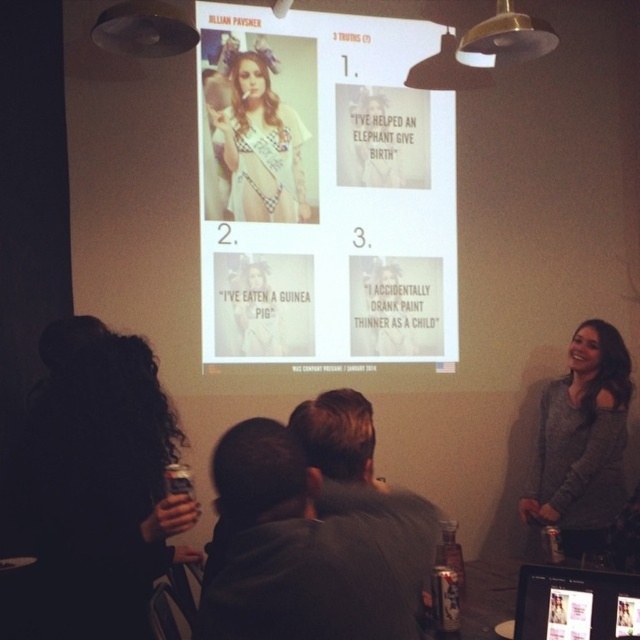
Question: Which of these objects is positioned closest to the dark curly hair at lower left?

Choices:
 (A) white paper at center
 (B) dark gray hoodie at center
 (C) matte plastic screen at lower right

Answer: (B)

Question: Does dark gray hoodie at center appear on the left side of matte plastic screen at lower right?

Choices:
 (A) yes
 (B) no

Answer: (A)

Question: Which point is farther from the camera taking this photo?

Choices:
 (A) (536, 632)
 (B) (292, 116)
 (C) (45, 429)

Answer: (B)

Question: Considering the real-world distances, which object is farthest from the checkered fabric bikini at center?

Choices:
 (A) matte plastic screen at lower right
 (B) gray sweater at center
 (C) white paper at center

Answer: (A)

Question: Is white paper at center bigger than dark curly hair at lower left?

Choices:
 (A) no
 (B) yes

Answer: (B)

Question: Does white paper at center appear on the left side of checkered fabric bikini at center?

Choices:
 (A) no
 (B) yes

Answer: (A)